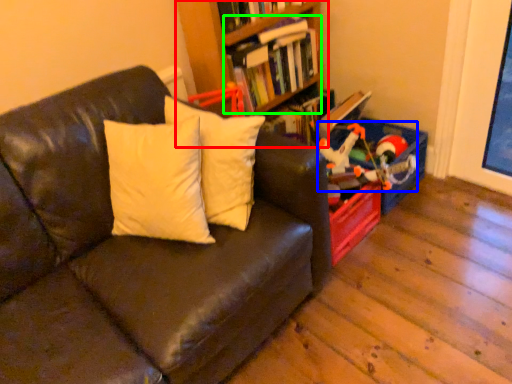
Question: Estimate the real-world distances between objects in this image. Which object is closer to bookcase (highlighted by a red box), toy (highlighted by a blue box) or book (highlighted by a green box)?

Choices:
 (A) toy
 (B) book

Answer: (B)